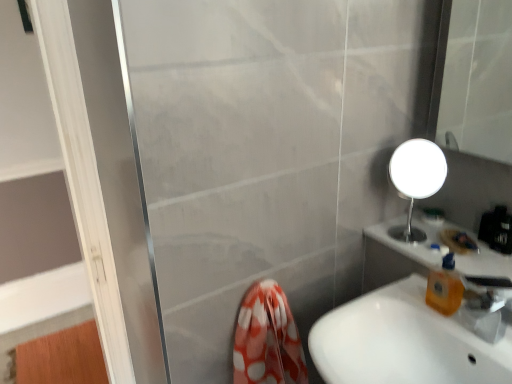
In order to face orange translucent soap dispenser at right, should I rotate leftwards or rightwards?

To align with it, rotate right about 23.984°.

This screenshot has height=384, width=512. What do you see at coordinates (403, 342) in the screenshot?
I see `white glossy sink at lower right` at bounding box center [403, 342].

Locate an element on the screen. transparent plastic tap at lower right is located at coordinates (485, 305).

Considering the sizes of objects orange translucent soap dispenser at right and transparent plastic tap at lower right in the image provided, who is thinner, orange translucent soap dispenser at right or transparent plastic tap at lower right?

orange translucent soap dispenser at right is thinner.

From a real-world perspective, who is located higher, orange translucent soap dispenser at right or transparent plastic tap at lower right?

From a 3D spatial view, orange translucent soap dispenser at right is above.

I want to click on soap dispenser above the transparent plastic tap at lower right (from the image's perspective), so click(x=445, y=287).

Based on the photo, can transparent plastic tap at lower right be found inside orange translucent soap dispenser at right?

Definitely not — transparent plastic tap at lower right is not inside orange translucent soap dispenser at right.

In the scene shown: Would you say transparent plastic tap at lower right is outside white glossy sink at lower right?

Yes.

Consider the image. Visually, is transparent plastic tap at lower right positioned to the left or to the right of white glossy sink at lower right?

Clearly, transparent plastic tap at lower right is on the right of white glossy sink at lower right in the image.

Is transparent plastic tap at lower right shorter than white glossy sink at lower right?

Yes, transparent plastic tap at lower right is shorter than white glossy sink at lower right.

In the scene shown: Between transparent plastic tap at lower right and white glossy sink at lower right, which one has larger width?

Wider between the two is white glossy sink at lower right.

Based on the photo, based on their sizes in the image, would you say orange translucent soap dispenser at right is bigger or smaller than white glossy sink at lower right?

In the image, orange translucent soap dispenser at right appears to be smaller than white glossy sink at lower right.

From the image's perspective, is orange translucent soap dispenser at right above white glossy sink at lower right?

Yes, from the image's perspective, orange translucent soap dispenser at right is above white glossy sink at lower right.

Considering the relative positions of orange translucent soap dispenser at right and white glossy sink at lower right in the image provided, is orange translucent soap dispenser at right to the left of white glossy sink at lower right from the viewer's perspective?

In fact, orange translucent soap dispenser at right is to the right of white glossy sink at lower right.

Does orange translucent soap dispenser at right have a lesser width compared to white glossy sink at lower right?

Yes, orange translucent soap dispenser at right is thinner than white glossy sink at lower right.

In the image, there is a orange translucent soap dispenser at right. Identify the location of tap below it (from a real-world perspective). (485, 305).

Based on their sizes in the image, would you say transparent plastic tap at lower right is bigger or smaller than orange translucent soap dispenser at right?

Clearly, transparent plastic tap at lower right is larger in size than orange translucent soap dispenser at right.

Is point (469, 318) closer or farther from the camera than point (444, 285)?

Point (469, 318) is positioned closer to the camera compared to point (444, 285).

Consider the image. From a real-world perspective, between transparent plastic tap at lower right and orange translucent soap dispenser at right, who is vertically lower?

From a 3D spatial view, transparent plastic tap at lower right is below.

From the image's perspective, which one is positioned higher, white glossy sink at lower right or orange translucent soap dispenser at right?

From the image's view, orange translucent soap dispenser at right is above.

Can you confirm if white glossy sink at lower right is positioned to the right of orange translucent soap dispenser at right?

In fact, white glossy sink at lower right is to the left of orange translucent soap dispenser at right.

Can you tell me how much white glossy sink at lower right and orange translucent soap dispenser at right differ in facing direction?

The facing directions of white glossy sink at lower right and orange translucent soap dispenser at right are 1.37 degrees apart.

Considering the positions of objects white glossy sink at lower right and orange translucent soap dispenser at right in the image provided, who is in front, white glossy sink at lower right or orange translucent soap dispenser at right?

white glossy sink at lower right is in front.

Can you see white glossy sink at lower right touching transparent plastic tap at lower right?

No, white glossy sink at lower right is not in contact with transparent plastic tap at lower right.

Which is correct: white glossy sink at lower right is inside transparent plastic tap at lower right, or outside of it?

white glossy sink at lower right exists outside the volume of transparent plastic tap at lower right.

Consider the image. Which object is further away from the camera, white glossy sink at lower right or transparent plastic tap at lower right?

transparent plastic tap at lower right is behind.

I want to click on soap dispenser behind the transparent plastic tap at lower right, so click(x=445, y=287).

Find the location of a particular element. This screenshot has height=384, width=512. sink on the left of transparent plastic tap at lower right is located at coordinates (403, 342).

Estimate the real-world distances between objects in this image. Which object is further from orange translucent soap dispenser at right, white glossy sink at lower right or transparent plastic tap at lower right?

The object further to orange translucent soap dispenser at right is white glossy sink at lower right.

When comparing their distances from transparent plastic tap at lower right, does orange translucent soap dispenser at right or white glossy sink at lower right seem further?

The object further to transparent plastic tap at lower right is white glossy sink at lower right.

When comparing their distances from white glossy sink at lower right, does orange translucent soap dispenser at right or transparent plastic tap at lower right seem further?

The object further to white glossy sink at lower right is transparent plastic tap at lower right.

Estimate the real-world distances between objects in this image. Which object is closer to transparent plastic tap at lower right, white glossy sink at lower right or orange translucent soap dispenser at right?

orange translucent soap dispenser at right lies closer to transparent plastic tap at lower right than the other object.

Estimate the real-world distances between objects in this image. Which object is further from white glossy sink at lower right, transparent plastic tap at lower right or orange translucent soap dispenser at right?

transparent plastic tap at lower right.

Looking at the image, which one is located closer to orange translucent soap dispenser at right, transparent plastic tap at lower right or white glossy sink at lower right?

transparent plastic tap at lower right.

Image resolution: width=512 pixels, height=384 pixels. Identify the location of tap between orange translucent soap dispenser at right and white glossy sink at lower right from top to bottom. (485, 305).